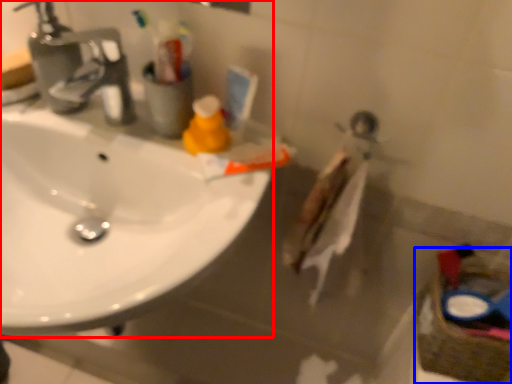
Question: Which of the following is the closest to the observer, sink (highlighted by a red box) or basket (highlighted by a blue box)?

Choices:
 (A) sink
 (B) basket

Answer: (A)